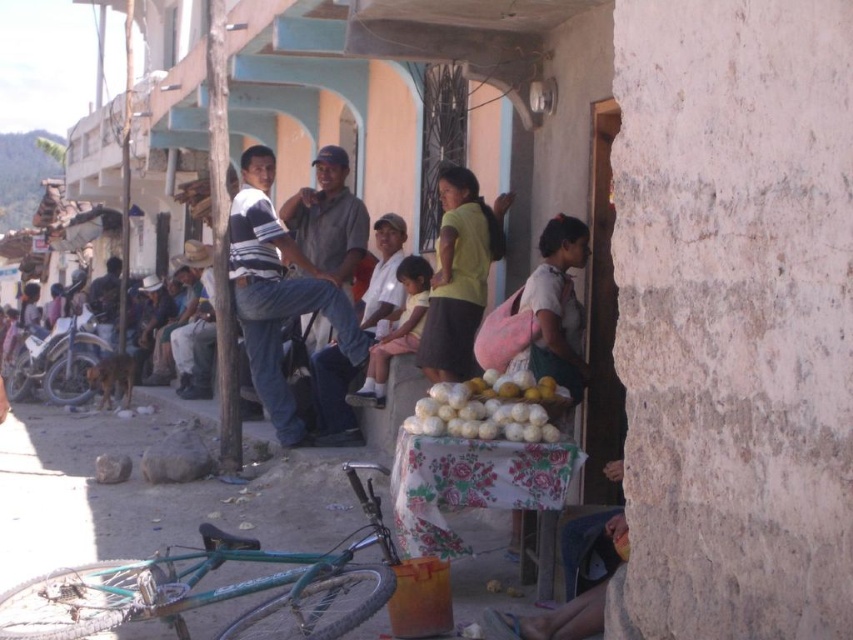
Can you confirm if denim jeans at center is taller than white matte produce at center?

Indeed, denim jeans at center has a greater height compared to white matte produce at center.

Identify the location of denim jeans at center. (292, 275).

Find the location of a particular element. Image resolution: width=853 pixels, height=640 pixels. denim jeans at center is located at coordinates (292, 275).